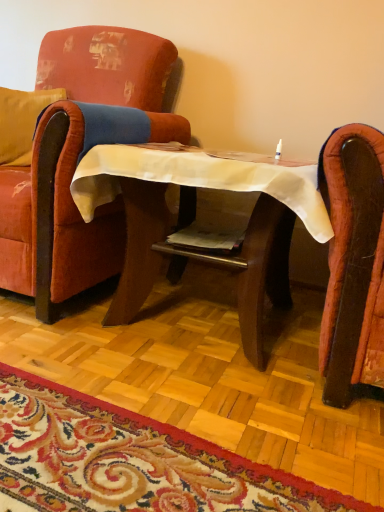
Question: Considering the relative sizes of carpet with floral pattern at lower center and wooden table at center in the image provided, is carpet with floral pattern at lower center taller than wooden table at center?

Choices:
 (A) no
 (B) yes

Answer: (A)

Question: Does carpet with floral pattern at lower center have a smaller size compared to wooden table at center?

Choices:
 (A) no
 (B) yes

Answer: (B)

Question: From the image's perspective, does carpet with floral pattern at lower center appear lower than wooden table at center?

Choices:
 (A) yes
 (B) no

Answer: (A)

Question: From the image's perspective, is carpet with floral pattern at lower center located above wooden table at center?

Choices:
 (A) yes
 (B) no

Answer: (B)

Question: Is the surface of carpet with floral pattern at lower center in direct contact with wooden table at center?

Choices:
 (A) yes
 (B) no

Answer: (B)

Question: Is carpet with floral pattern at lower center behind wooden table at center?

Choices:
 (A) no
 (B) yes

Answer: (A)

Question: Is velvet red armchair at left outside carpet with floral pattern at lower center?

Choices:
 (A) no
 (B) yes

Answer: (B)

Question: From the image's perspective, does velvet red armchair at left appear lower than carpet with floral pattern at lower center?

Choices:
 (A) no
 (B) yes

Answer: (A)

Question: Is carpet with floral pattern at lower center a part of velvet red armchair at left?

Choices:
 (A) no
 (B) yes

Answer: (A)

Question: Considering the relative sizes of velvet red armchair at left and carpet with floral pattern at lower center in the image provided, is velvet red armchair at left bigger than carpet with floral pattern at lower center?

Choices:
 (A) no
 (B) yes

Answer: (B)

Question: Is velvet red armchair at left in front of carpet with floral pattern at lower center?

Choices:
 (A) yes
 (B) no

Answer: (B)

Question: Is velvet red armchair at left smaller than carpet with floral pattern at lower center?

Choices:
 (A) yes
 (B) no

Answer: (B)

Question: Is wooden table at center oriented away from velvet red armchair at left?

Choices:
 (A) yes
 (B) no

Answer: (B)